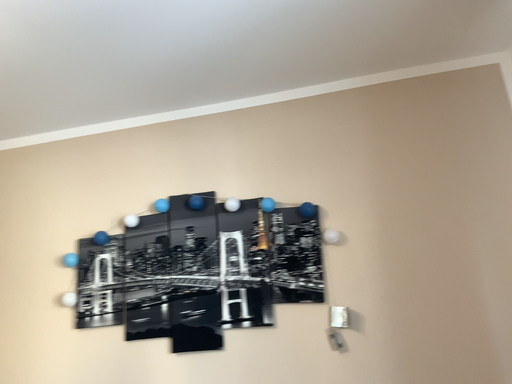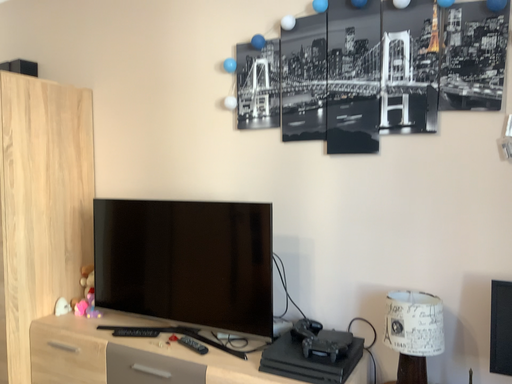
Question: Which way did the camera rotate in the video?

Choices:
 (A) rotated right
 (B) rotated left

Answer: (B)